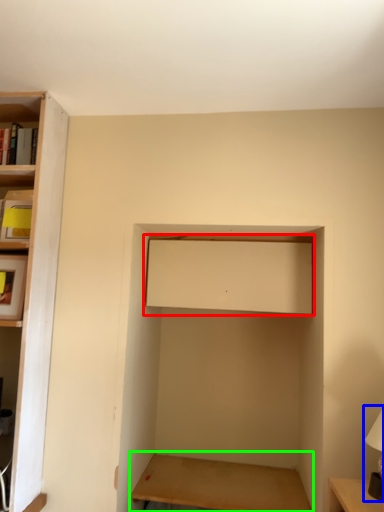
Question: Which is farther away from cabinet (highlighted by a red box)? table lamp (highlighted by a blue box) or table (highlighted by a green box)?

Choices:
 (A) table lamp
 (B) table

Answer: (B)